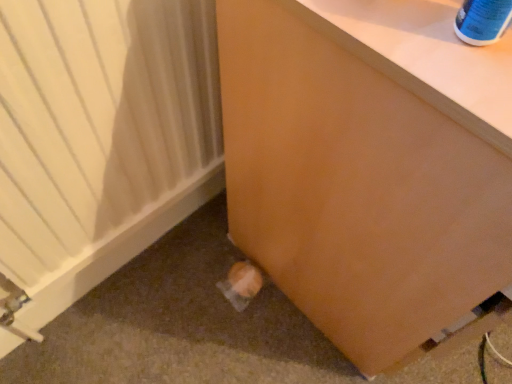
Question: From the image's perspective, is white matte heater at lower left below matte brown drawer at lower right?

Choices:
 (A) yes
 (B) no

Answer: (A)

Question: Does white matte heater at lower left have a larger size compared to matte brown drawer at lower right?

Choices:
 (A) no
 (B) yes

Answer: (A)

Question: From the image's perspective, is white matte heater at lower left on top of matte brown drawer at lower right?

Choices:
 (A) yes
 (B) no

Answer: (B)

Question: Can you confirm if white matte heater at lower left is taller than matte brown drawer at lower right?

Choices:
 (A) yes
 (B) no

Answer: (B)

Question: Could matte brown drawer at lower right be considered to be inside white matte heater at lower left?

Choices:
 (A) yes
 (B) no

Answer: (B)

Question: Is white matte heater at lower left shorter than matte brown drawer at lower right?

Choices:
 (A) yes
 (B) no

Answer: (A)

Question: From the image's perspective, is matte brown drawer at lower right located above white matte heater at lower left?

Choices:
 (A) no
 (B) yes

Answer: (B)

Question: Does matte brown drawer at lower right have a greater height compared to white matte heater at lower left?

Choices:
 (A) no
 (B) yes

Answer: (B)

Question: Can you confirm if matte brown drawer at lower right is smaller than white matte heater at lower left?

Choices:
 (A) no
 (B) yes

Answer: (A)

Question: From a real-world perspective, is matte brown drawer at lower right physically above white matte heater at lower left?

Choices:
 (A) no
 (B) yes

Answer: (B)

Question: Is matte brown drawer at lower right positioned beyond the bounds of white matte heater at lower left?

Choices:
 (A) no
 (B) yes

Answer: (B)

Question: Is matte brown drawer at lower right turned away from white matte heater at lower left?

Choices:
 (A) yes
 (B) no

Answer: (B)

Question: Is white matte heater at lower left in front of or behind matte brown drawer at lower right in the image?

Choices:
 (A) front
 (B) behind

Answer: (B)